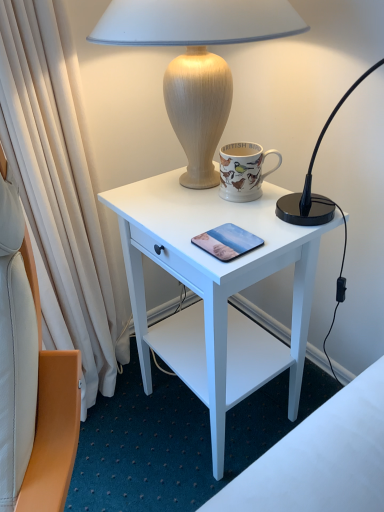
Image resolution: width=384 pixels, height=512 pixels. I want to click on vacant space that is to the left of porcelain mug with colorful birds at upper center, so (174, 203).